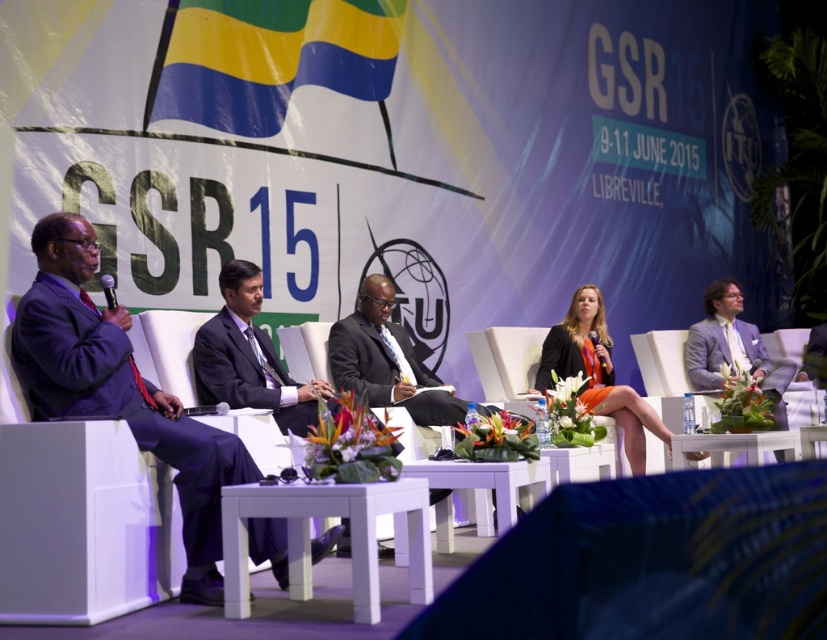
Who is higher up, orange fabric dress at center or metallic silver microphone at left?

metallic silver microphone at left is higher up.

Is orange fabric dress at center wider than metallic silver microphone at left?

Indeed, orange fabric dress at center has a greater width compared to metallic silver microphone at left.

You are a GUI agent. You are given a task and a screenshot of the screen. Output one action in this format:
    pyautogui.click(x=<x>, y=<y>)
    Task: Click on the orange fabric dress at center
    
    Given the screenshot: What is the action you would take?
    pyautogui.click(x=596, y=372)

Is point (92, 237) more distant than point (381, 275)?

That is False.

Which is below, matte black suit at left or dark suit at center?

matte black suit at left is below.

I want to click on matte black suit at left, so click(118, 390).

Is dark suit at center below orange fabric dress at center?

Actually, dark suit at center is above orange fabric dress at center.

I want to click on dark suit at center, so click(385, 358).